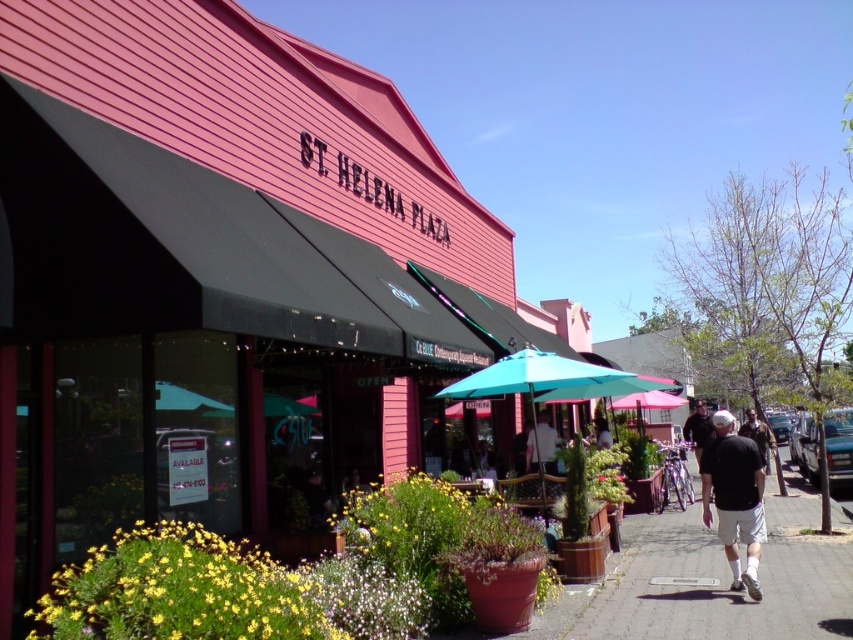
Which is above, gray concrete sidewalk at lower right or black cotton shirt at lower right?

Positioned higher is black cotton shirt at lower right.

What do you see at coordinates (726, 579) in the screenshot? I see `gray concrete sidewalk at lower right` at bounding box center [726, 579].

Which is in front, point (669, 545) or point (751, 552)?

Point (751, 552) is in front.

Locate an element on the screen. The height and width of the screenshot is (640, 853). gray concrete sidewalk at lower right is located at coordinates (726, 579).

Can you confirm if dark gray shirt at right is positioned below dark gray shirt at center?

Correct, dark gray shirt at right is located below dark gray shirt at center.

Who is lower down, dark gray shirt at right or dark gray shirt at center?

dark gray shirt at right is below.

Where is `dark gray shirt at right`? dark gray shirt at right is located at coordinates (698, 429).

Between teal fabric umbrella at center and matte white shirt at center, which one has more height?

Standing taller between the two is teal fabric umbrella at center.

Is teal fabric umbrella at center behind matte white shirt at center?

No.

You are a GUI agent. You are given a task and a screenshot of the screen. Output one action in this format:
    pyautogui.click(x=<x>, y=<y>)
    Task: Click on the teal fabric umbrella at center
    This screenshot has width=853, height=640.
    Given the screenshot: What is the action you would take?
    pyautogui.click(x=550, y=380)